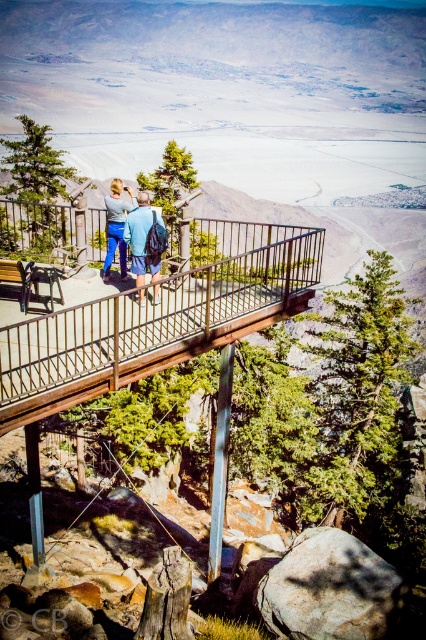
You are standing on the wooden platform at the overlook and want to place your blue fabric backpack at center so it doesn not block the view of the expansive landscape behind the matte blue jeans at center. Based on their positions, should you move the backpack to the left or right?

The blue fabric backpack at center is currently to the right of the matte blue jeans at center. To avoid blocking the view behind the jeans, you should move the backpack to the left.

You are a hiker who wants to know if your blue fabric backpack at center can be placed on the ground without covering your matte blue jeans at center. Based on their sizes, is this possible?

The blue fabric backpack at center is taller than the matte blue jeans at center, so placing it on the ground might cover the jeans unless positioned carefully.

You are standing on the wooden platform and want to place your blue fabric backpack at center on the ground. However, you are currently wearing your matte blue jeans at center. Will the backpack be visible under your jeans?

The blue fabric backpack at center is located below matte blue jeans at center, so yes, the backpack will be visible under your jeans since it is positioned beneath them.